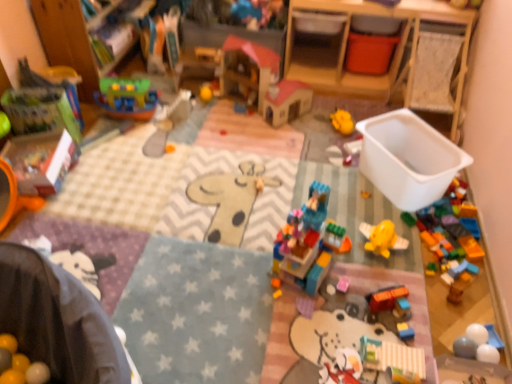
The image size is (512, 384). What are the coordinates of `vacant space that's between translucent plastic airplane at center, which appears as the seventh toy when viewed from the top, and yellow matte ball at center, acting as the 3th toy starting from the top` in the screenshot? It's located at (270, 139).